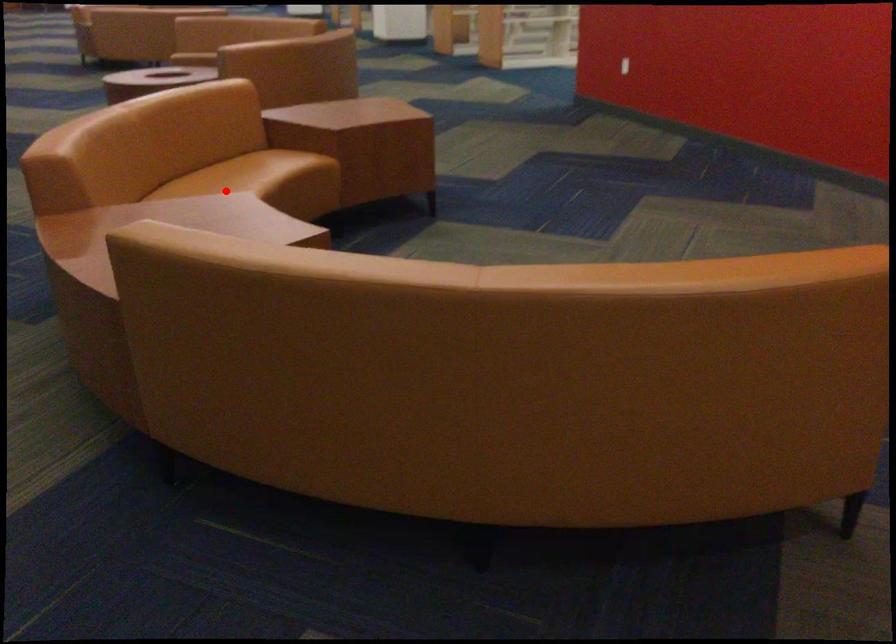
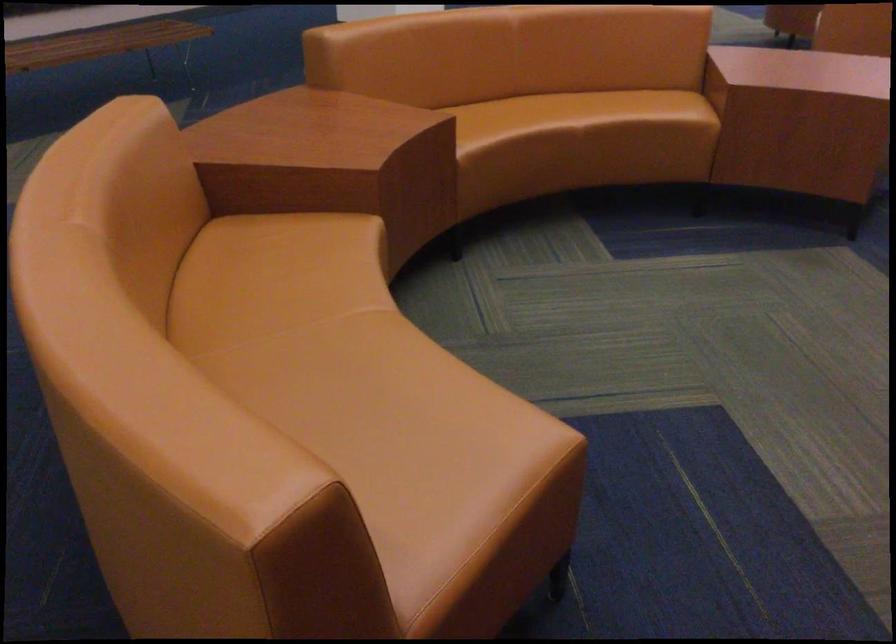
Find the pixel in the second image that matches the highlighted location in the first image.

(538, 113)